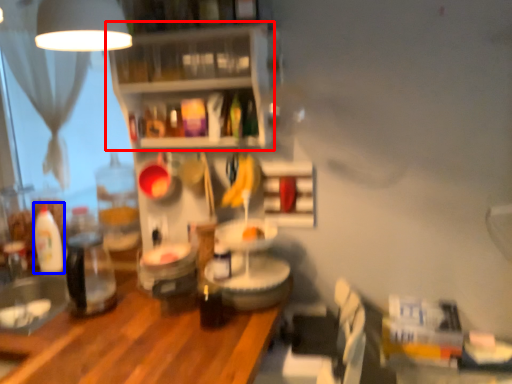
Question: Which of the following is the farthest to the observer, shelf (highlighted by a red box) or bottle (highlighted by a blue box)?

Choices:
 (A) shelf
 (B) bottle

Answer: (B)